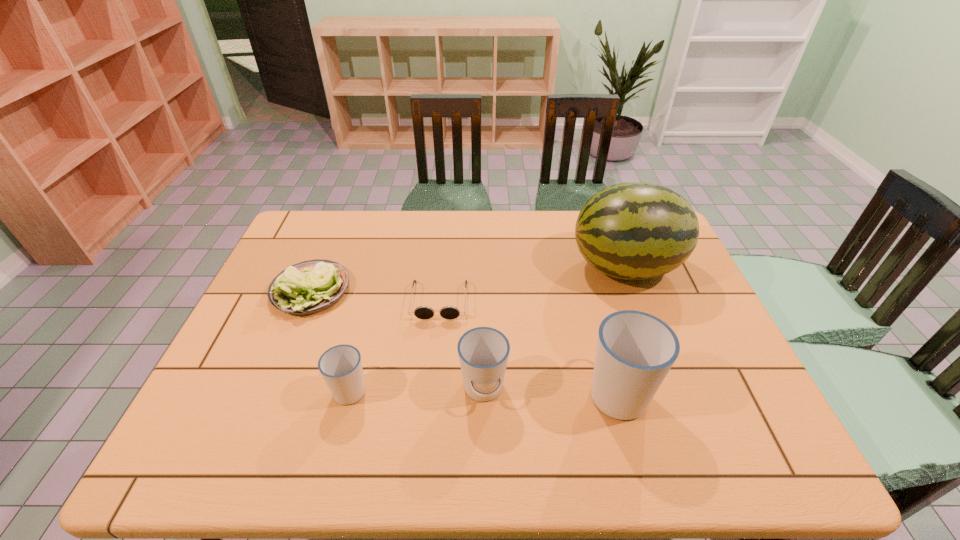
Where is `vacant space positioned 0.330m on the right of the leftmost object`? This screenshot has width=960, height=540. vacant space positioned 0.330m on the right of the leftmost object is located at coordinates (461, 291).

Identify the location of object situated at the far edge. (635, 230).

The height and width of the screenshot is (540, 960). What are the coordinates of `object that is at the left edge` in the screenshot? It's located at (309, 287).

At what (x,y) coordinates should I click in order to perform the action: click on object that is at the right edge. Please return your answer as a coordinate pair (x, y). Looking at the image, I should click on (635, 230).

Locate an element on the screen. The image size is (960, 540). object at the far right corner is located at coordinates (635, 230).

Locate an element on the screen. This screenshot has height=540, width=960. free space at the far edge of the desktop is located at coordinates (464, 221).

Locate an element on the screen. This screenshot has width=960, height=540. vacant space at the near edge of the desktop is located at coordinates (526, 390).

At what (x,y) coordinates should I click in order to perform the action: click on free region at the left edge of the desktop. Please return your answer as a coordinate pair (x, y). Looking at the image, I should click on (273, 267).

The image size is (960, 540). In the image, there is a desktop. Find the location of `vacant space at the right edge`. vacant space at the right edge is located at coordinates (644, 284).

This screenshot has height=540, width=960. I want to click on vacant area at the far left corner of the desktop, so click(x=283, y=250).